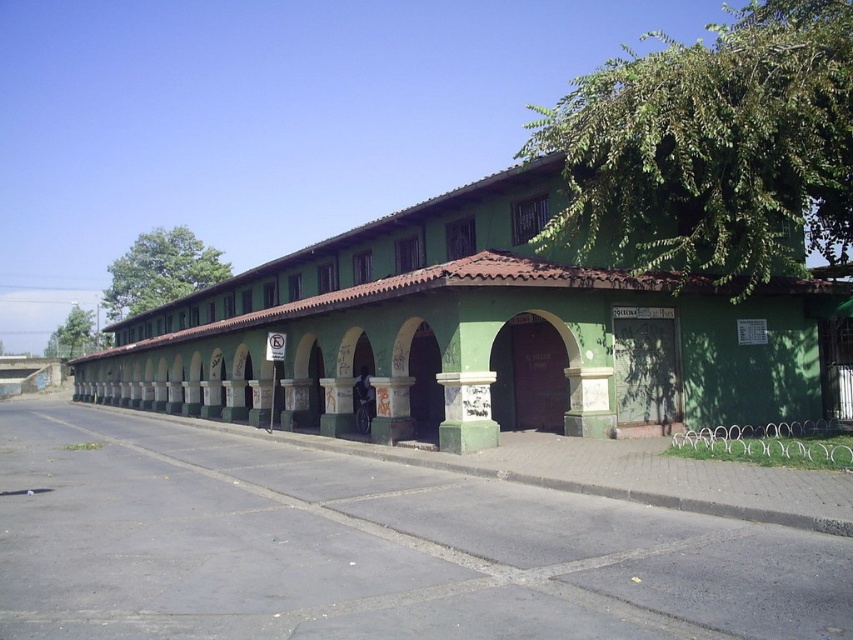
Does green leafy tree at upper right have a lesser width compared to green leafy tree at left?

No.

Is point (799, 83) positioned behind point (73, 342)?

No.

At what (x,y) coordinates should I click in order to perform the action: click on green leafy tree at upper right. Please return your answer as a coordinate pair (x, y). This screenshot has width=853, height=640. Looking at the image, I should click on (712, 147).

Based on the photo, between green leafy tree at upper left and green leafy tree at left, which one has more height?

green leafy tree at upper left

Can you confirm if green leafy tree at upper left is bigger than green leafy tree at left?

Yes, green leafy tree at upper left is bigger than green leafy tree at left.

Does point (202, 243) come behind point (68, 317)?

Yes, it is behind point (68, 317).

Find the location of a particular element. green leafy tree at upper left is located at coordinates (160, 272).

Is green leafy tree at upper right to the left of green leafy tree at upper left from the viewer's perspective?

No, green leafy tree at upper right is not to the left of green leafy tree at upper left.

Who is positioned more to the right, green leafy tree at upper right or green leafy tree at upper left?

Positioned to the right is green leafy tree at upper right.

Between point (787, 172) and point (143, 236), which one is positioned behind?

Positioned behind is point (143, 236).

Locate an element on the screen. This screenshot has height=640, width=853. green leafy tree at upper right is located at coordinates (712, 147).